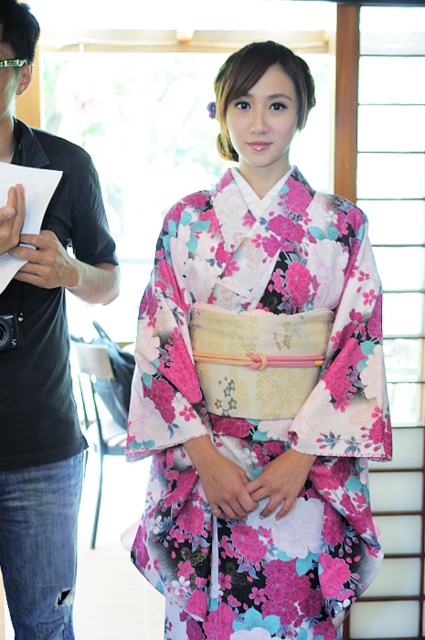
What do you see at coordinates (260, 420) in the screenshot? This screenshot has width=425, height=640. I see `floral silk kimono at center` at bounding box center [260, 420].

I want to click on floral silk kimono at center, so click(260, 420).

Between point (172, 460) and point (16, 6), which one is positioned behind?

Point (172, 460)

Locate an element on the screen. floral silk kimono at center is located at coordinates (260, 420).